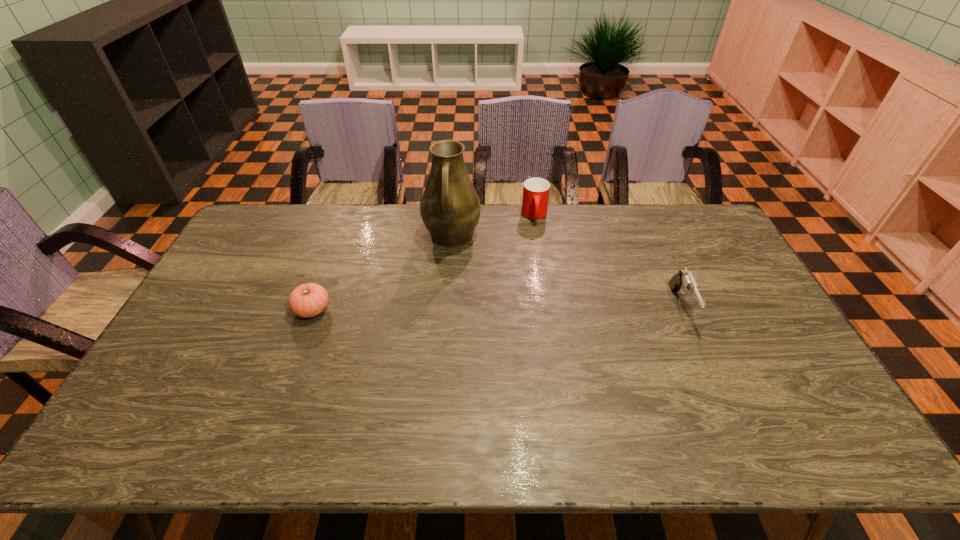
Locate an element on the screen. vacant space that's between the second object from right to left and the gun is located at coordinates [x=608, y=261].

The height and width of the screenshot is (540, 960). What are the coordinates of `unoccupied position between the tomato and the pitcher` in the screenshot? It's located at (382, 273).

Locate which object ranks second in proximity to the third object from left to right. Please provide its 2D coordinates. Your answer should be formatted as a tuple, i.e. [(x, y)], where the tuple contains the x and y coordinates of a point satisfying the conditions above.

[(684, 279)]

Locate which object ranks in proximity to the rightmost object. Please provide its 2D coordinates. Your answer should be formatted as a tuple, i.e. [(x, y)], where the tuple contains the x and y coordinates of a point satisfying the conditions above.

[(536, 191)]

Find the location of `free region that satisfies the following two spatial constraints: 1. on the back side of the tallest object; 2. on the left side of the shortest object`. free region that satisfies the following two spatial constraints: 1. on the back side of the tallest object; 2. on the left side of the shortest object is located at coordinates (339, 237).